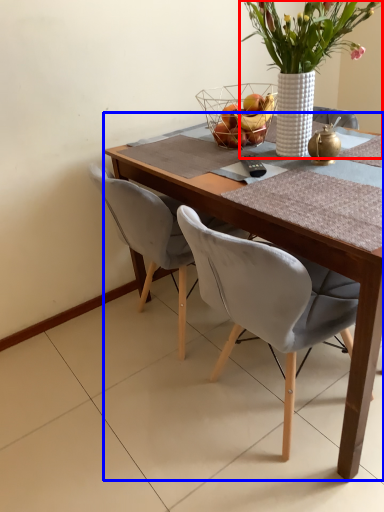
Question: Which object is further to the camera taking this photo, houseplant (highlighted by a red box) or round table (highlighted by a blue box)?

Choices:
 (A) houseplant
 (B) round table

Answer: (A)